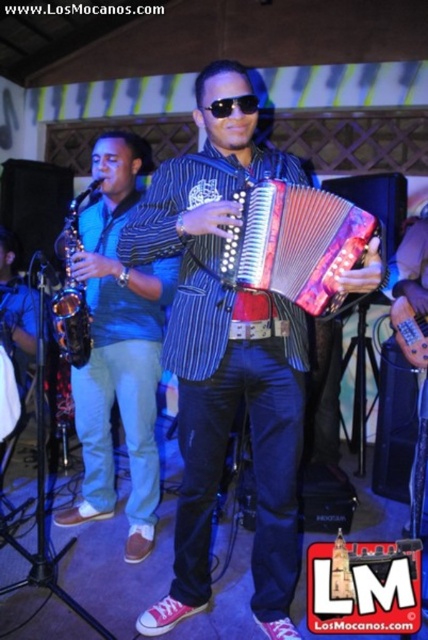
Consider the image. You are a stagehand setting up a spotlight for the musician wearing shiny blue jeans at center. The saxophone player with the satin gold saxophone at left is also on stage. Where should you aim the spotlight to ensure it doesn

The shiny blue jeans at center is positioned under the satin gold saxophone at left. Therefore, aiming the spotlight at the shiny blue jeans at center would place it directly below the saxophone player, ensuring proper illumination without obstruction.

You are a photographer at the back of the stage. You want to take a photo of the shiny blue jeans at center and the brushed metal saxophone at left. Which object should you focus on first if you want to capture both in the same frame?

The shiny blue jeans at center is located below the brushed metal saxophone at left, so you should focus on the brushed metal saxophone at left first to ensure both objects are in the frame.